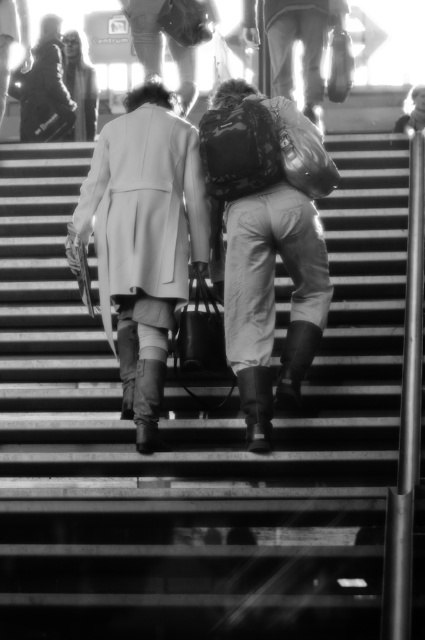
Does white matte coat at center have a greater height compared to matte gray coat at upper left?

Indeed, white matte coat at center has a greater height compared to matte gray coat at upper left.

Which of these two, white matte coat at center or matte gray coat at upper left, stands shorter?

matte gray coat at upper left is shorter.

What do you see at coordinates (142, 240) in the screenshot?
I see `white matte coat at center` at bounding box center [142, 240].

Identify the location of white matte coat at center. The height and width of the screenshot is (640, 425). (142, 240).

Between camouflage backpack at center and matte gray coat at upper left, which one appears on the left side from the viewer's perspective?

From the viewer's perspective, matte gray coat at upper left appears more on the left side.

Is camouflage backpack at center to the right of matte gray coat at upper left from the viewer's perspective?

Yes, camouflage backpack at center is to the right of matte gray coat at upper left.

Identify the location of camouflage backpack at center. The width and height of the screenshot is (425, 640). (268, 240).

In the scene shown: Between camouflage backpack at center and white matte coat at center, which one has less height?

camouflage backpack at center

Which is behind, point (240, 244) or point (189, 248)?

Positioned behind is point (189, 248).

Identify the location of camouflage backpack at center. The height and width of the screenshot is (640, 425). (268, 240).